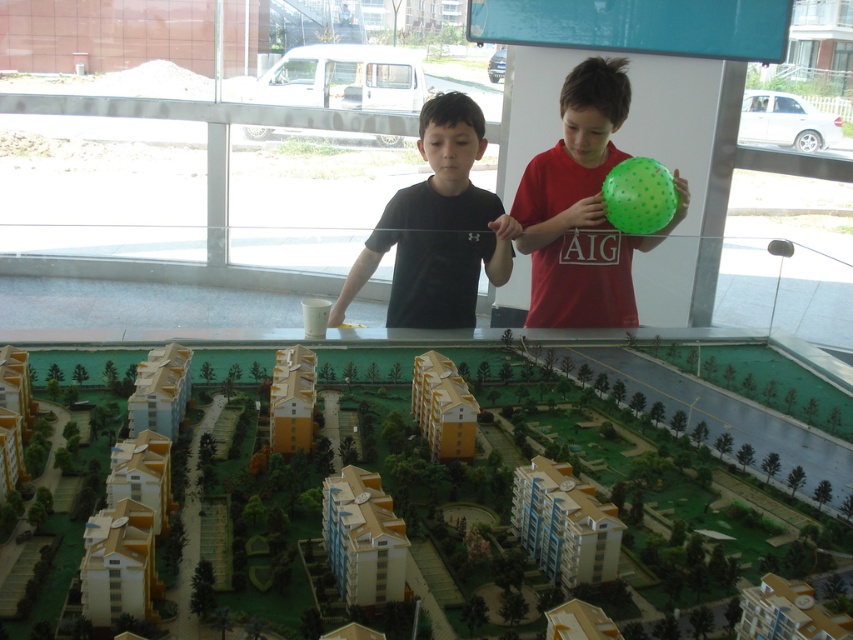
You are a photographer standing in front of the glass table with the model. You want to take a photo of the green dotted balloon at center without any obstructions. Based on the coordinates provided, can you position yourself directly in front of the balloon to ensure it is centered in your frame?

The green dotted balloon at center is located at coordinates (582, 209). Since the balloon is already at the center position, you can position yourself directly in front of it to center it in your frame without obstructions.

You are a photographer standing in front of the glass table with the model. You want to take a photo of the green dotted balloon at center and the black matte shirt at center. Based on their sizes, which object will appear smaller in the photo?

The green dotted balloon at center has a lesser width compared to the black matte shirt at center, so it will appear smaller in the photo.